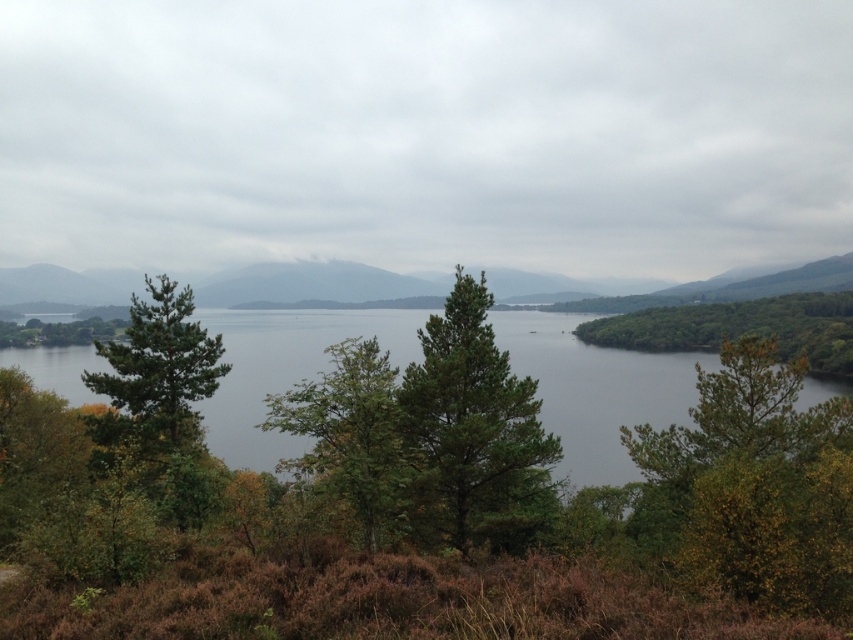
Which is more to the right, green matte tree at left or green leafy tree at right?

Positioned to the right is green leafy tree at right.

The image size is (853, 640). What do you see at coordinates (157, 372) in the screenshot?
I see `green matte tree at left` at bounding box center [157, 372].

At what (x,y) coordinates should I click in order to perform the action: click on green matte tree at left. Please return your answer as a coordinate pair (x, y). Looking at the image, I should click on tap(157, 372).

Does clear water at center have a smaller size compared to green matte tree at center?

Incorrect, clear water at center is not smaller in size than green matte tree at center.

Can you confirm if clear water at center is positioned to the right of green matte tree at center?

In fact, clear water at center is to the left of green matte tree at center.

Locate an element on the screen. The image size is (853, 640). clear water at center is located at coordinates (596, 390).

In the scene shown: Who is lower down, matte green mountain at center or green leafy tree at center?

Positioned lower is green leafy tree at center.

This screenshot has width=853, height=640. Describe the element at coordinates (311, 284) in the screenshot. I see `matte green mountain at center` at that location.

Does point (805, 269) lie in front of point (376, 385)?

That is False.

The height and width of the screenshot is (640, 853). Identify the location of matte green mountain at center. (311, 284).